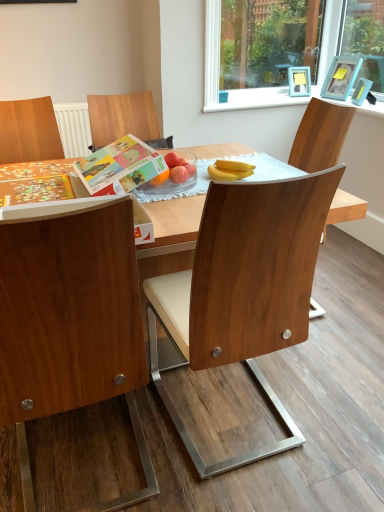
Locate an element on the screen. vacant space underneath wooden chair at left, placed as the 2th chair when sorted from right to left (from a real-world perspective) is located at coordinates (84, 460).